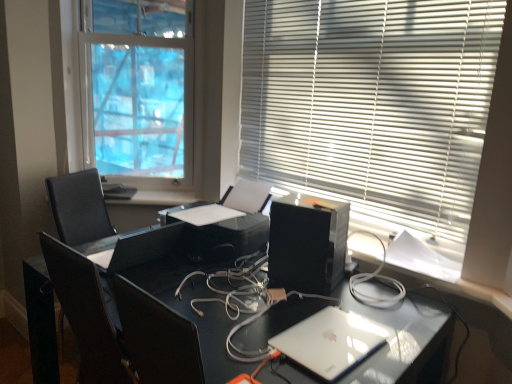
Question: Does white blinds at upper right, the first window blind when ordered from back to front, have a greater width compared to satin black desk at center?

Choices:
 (A) no
 (B) yes

Answer: (A)

Question: From a real-world perspective, is white blinds at upper right, the first window blind positioned from the left, below satin black desk at center?

Choices:
 (A) no
 (B) yes

Answer: (A)

Question: Is white blinds at upper right, which is the second window blind in right-to-left order, to the left of satin black desk at center from the viewer's perspective?

Choices:
 (A) yes
 (B) no

Answer: (A)

Question: Is white blinds at upper right, the first window blind when ordered from back to front, beside satin black desk at center?

Choices:
 (A) yes
 (B) no

Answer: (B)

Question: Does white blinds at upper right, the first window blind when ordered from back to front, have a greater height compared to satin black desk at center?

Choices:
 (A) no
 (B) yes

Answer: (B)

Question: Based on their positions, is white glossy window sill at center located to the left or right of matte black monitor at center?

Choices:
 (A) left
 (B) right

Answer: (A)

Question: In terms of width, does white glossy window sill at center look wider or thinner when compared to matte black monitor at center?

Choices:
 (A) wide
 (B) thin

Answer: (B)

Question: From the image's perspective, is white glossy window sill at center positioned above or below matte black monitor at center?

Choices:
 (A) above
 (B) below

Answer: (A)

Question: From their relative heights in the image, would you say white glossy window sill at center is taller or shorter than matte black monitor at center?

Choices:
 (A) short
 (B) tall

Answer: (A)

Question: From a real-world perspective, relative to white plastic blinds at upper right, the 2th window blind from the back, is white blinds at upper right, which is the second window blind in right-to-left order, vertically above or below?

Choices:
 (A) below
 (B) above

Answer: (A)

Question: Is white blinds at upper right, which is the second window blind in right-to-left order, situated inside white plastic blinds at upper right, which is the 1th window blind from right to left, or outside?

Choices:
 (A) inside
 (B) outside

Answer: (B)

Question: In terms of width, does white blinds at upper right, positioned as the 2th window blind in front-to-back order, look wider or thinner when compared to white plastic blinds at upper right, which is the 1th window blind from right to left?

Choices:
 (A) wide
 (B) thin

Answer: (A)

Question: Based on their sizes in the image, would you say white blinds at upper right, the first window blind when ordered from back to front, is bigger or smaller than white plastic blinds at upper right, which is the 1th window blind from right to left?

Choices:
 (A) big
 (B) small

Answer: (B)

Question: Is white glossy window sill at center in front of or behind black plastic printer at center in the image?

Choices:
 (A) front
 (B) behind

Answer: (B)

Question: Is white glossy window sill at center wider or thinner than black plastic printer at center?

Choices:
 (A) wide
 (B) thin

Answer: (B)